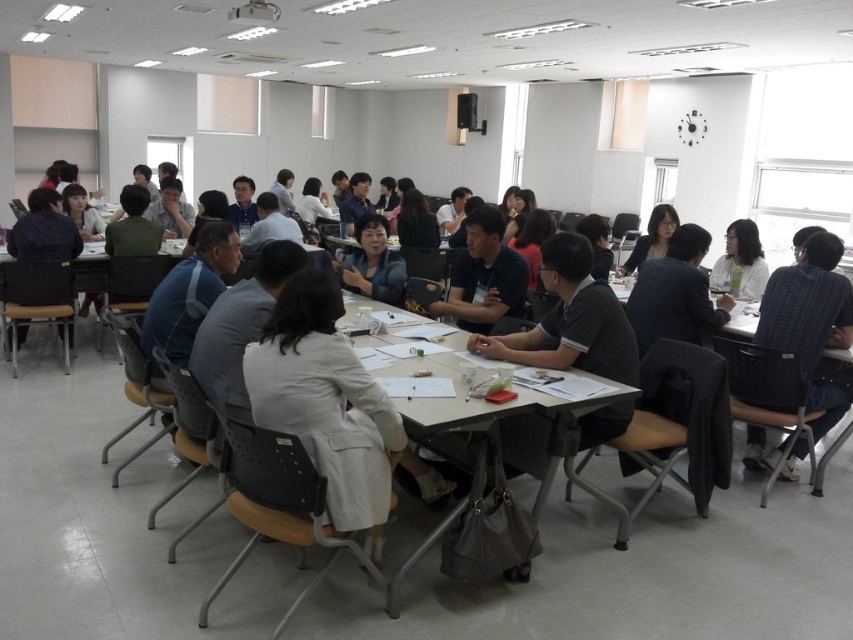
Is white fabric jacket at center shorter than matte black jacket at left?

No, white fabric jacket at center is not shorter than matte black jacket at left.

Which of these two, white fabric jacket at center or matte black jacket at left, stands shorter?

With less height is matte black jacket at left.

Find the location of a particular element. white fabric jacket at center is located at coordinates (329, 406).

Is white paper at center shorter than matte black jacket at left?

Incorrect, white paper at center's height does not fall short of matte black jacket at left's.

Identify the location of white paper at center. This screenshot has width=853, height=640. pyautogui.click(x=511, y=429).

Where is `white paper at center`? The width and height of the screenshot is (853, 640). white paper at center is located at coordinates (511, 429).

Who is lower down, matte black shirt at center or light blue shirt at center?

Positioned lower is matte black shirt at center.

Is matte black shirt at center above light blue shirt at center?

No, matte black shirt at center is not above light blue shirt at center.

Is point (447, 314) in front of point (345, 280)?

Yes, it is.

At what (x,y) coordinates should I click in order to perform the action: click on matte black shirt at center. Please return your answer as a coordinate pair (x, y). This screenshot has width=853, height=640. Looking at the image, I should click on (485, 275).